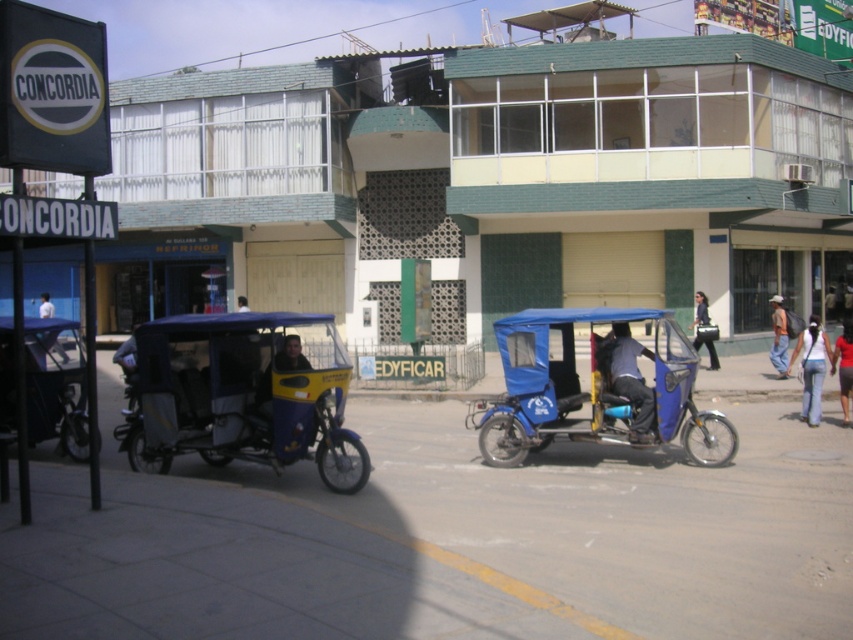
Question: Observing the image, what is the correct spatial positioning of white cotton shirt at lower right in reference to blue fabric tuk-tuk at center?

Choices:
 (A) left
 (B) right

Answer: (B)

Question: Where is yellow matte taxi at center located in relation to dark blue fabric tuk-tuk at center in the image?

Choices:
 (A) right
 (B) left

Answer: (A)

Question: Among these objects, which one is farthest from the camera?

Choices:
 (A) white cotton shirt at lower right
 (B) dark blue fabric tuk-tuk at center
 (C) blue matte tricycle at center

Answer: (B)

Question: Is blue matte tricycle at center closer to camera compared to red fabric shirt at center?

Choices:
 (A) yes
 (B) no

Answer: (A)

Question: Which point is farther to the camera?

Choices:
 (A) blue fabric tuk-tuk at center
 (B) black fabric bag at center
 (C) dark blue fabric tuk-tuk at center

Answer: (A)

Question: Which point is closer to the camera taking this photo?

Choices:
 (A) (640, 445)
 (B) (811, 323)
 (C) (358, 456)
 (D) (241, 300)

Answer: (C)